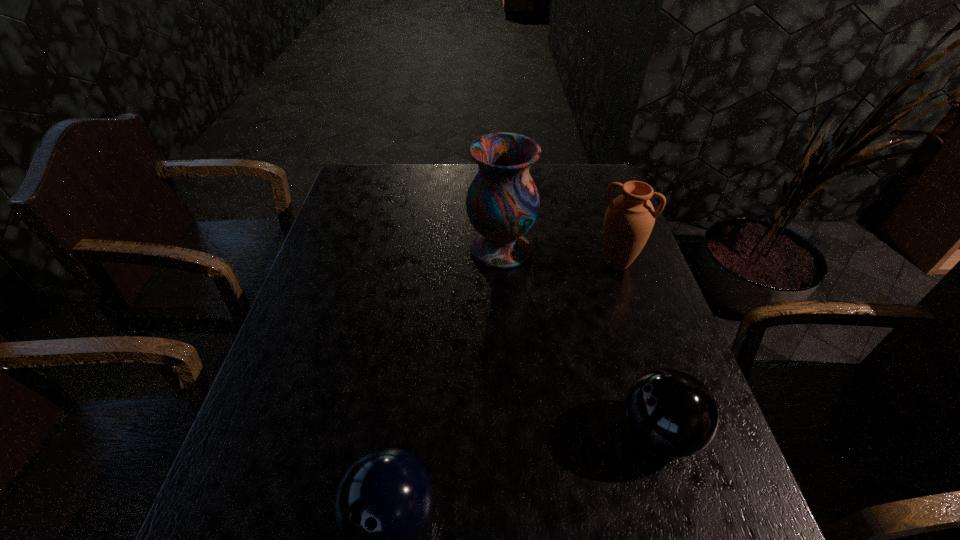
This screenshot has width=960, height=540. What are the coordinates of `bowling ball located in the right edge section of the desktop` in the screenshot? It's located at (671, 412).

Where is `vacant area at the far edge`? The height and width of the screenshot is (540, 960). vacant area at the far edge is located at coordinates (439, 196).

Image resolution: width=960 pixels, height=540 pixels. What are the coordinates of `blank space at the left edge of the desktop` in the screenshot? It's located at (267, 387).

In the image, there is a desktop. At what (x,y) coordinates should I click in order to perform the action: click on vacant space at the right edge. Please return your answer as a coordinate pair (x, y). Looking at the image, I should click on (579, 223).

Find the location of a particular element. vacant space at the far left corner of the desktop is located at coordinates (348, 200).

In the image, there is a desktop. At what (x,y) coordinates should I click in order to perform the action: click on free space at the far right corner. Please return your answer as a coordinate pair (x, y). The height and width of the screenshot is (540, 960). Looking at the image, I should click on (585, 197).

Image resolution: width=960 pixels, height=540 pixels. I want to click on unoccupied position between the urn and the tallest object, so click(x=559, y=256).

Locate an element on the screen. The height and width of the screenshot is (540, 960). free space between the second tallest object and the right bowling ball is located at coordinates (637, 348).

You are a GUI agent. You are given a task and a screenshot of the screen. Output one action in this format:
    pyautogui.click(x=<x>, y=<y>)
    Task: Click on the free space between the tallest object and the urn
    
    Given the screenshot: What is the action you would take?
    pyautogui.click(x=559, y=256)

Find the location of `object that ranks as the third closest to the tallest object`. object that ranks as the third closest to the tallest object is located at coordinates (384, 501).